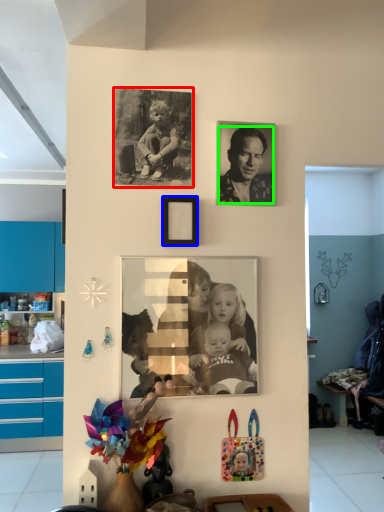
Question: Estimate the real-world distances between objects in this image. Which object is farther from picture frame (highlighted by a red box), picture frame (highlighted by a blue box) or person (highlighted by a green box)?

Choices:
 (A) picture frame
 (B) person

Answer: (B)